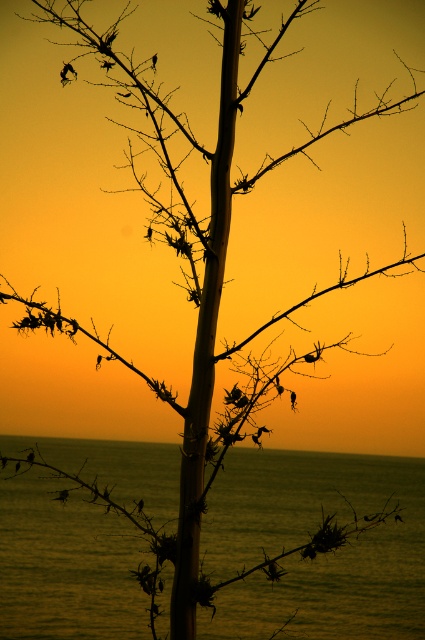
Who is more forward, (331, 477) or (59, 317)?

Point (59, 317) is more forward.

Is smooth water at center positioned before silhouette thorny branch at center?

No, smooth water at center is behind silhouette thorny branch at center.

Between point (115, 524) and point (53, 317), which one is positioned behind?

Positioned behind is point (115, 524).

The width and height of the screenshot is (425, 640). I want to click on smooth water at center, so click(317, 556).

Is brown thorny branch at center to the left of silvery metallic branch at center from the viewer's perspective?

Correct, you'll find brown thorny branch at center to the left of silvery metallic branch at center.

The width and height of the screenshot is (425, 640). What are the coordinates of `brown thorny branch at center` in the screenshot? It's located at (317, 540).

Is silhouette thorny branch at center shorter than brown thorny branch at lower left?

No.

Where is `silhouette thorny branch at center`? Image resolution: width=425 pixels, height=640 pixels. silhouette thorny branch at center is located at coordinates (74, 339).